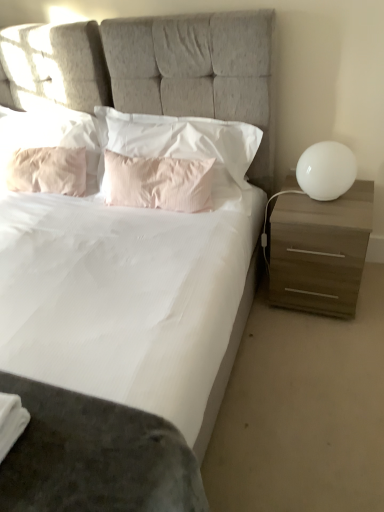
Locate an element on the screen. The width and height of the screenshot is (384, 512). blank space above light brown wood nightstand at right (from a real-world perspective) is located at coordinates (324, 206).